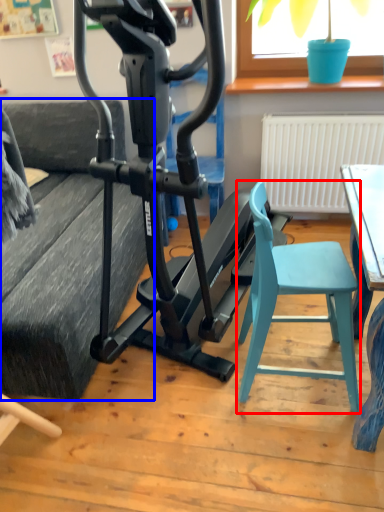
Question: Which object appears farthest to the camera in this image, folding chair (highlighted by a red box) or couch (highlighted by a blue box)?

Choices:
 (A) folding chair
 (B) couch

Answer: (B)